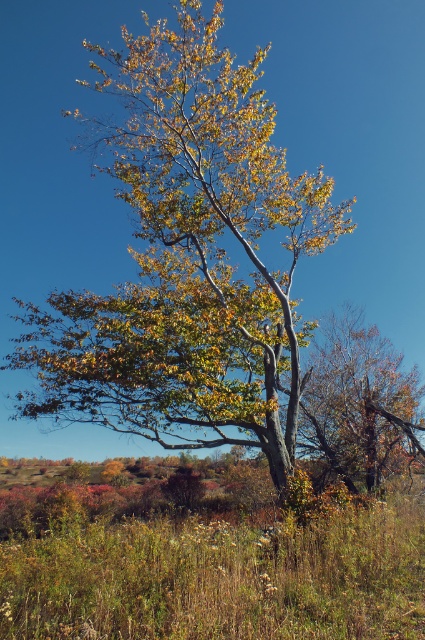
Question: Which point is closer to the camera?

Choices:
 (A) green grass at center
 (B) autumn leaves at center

Answer: (A)

Question: Does green grass at center appear over autumn leaves at center?

Choices:
 (A) yes
 (B) no

Answer: (B)

Question: Can you confirm if green grass at center is wider than autumn leaves at center?

Choices:
 (A) yes
 (B) no

Answer: (A)

Question: Is green grass at center above autumn leaves at center?

Choices:
 (A) yes
 (B) no

Answer: (B)